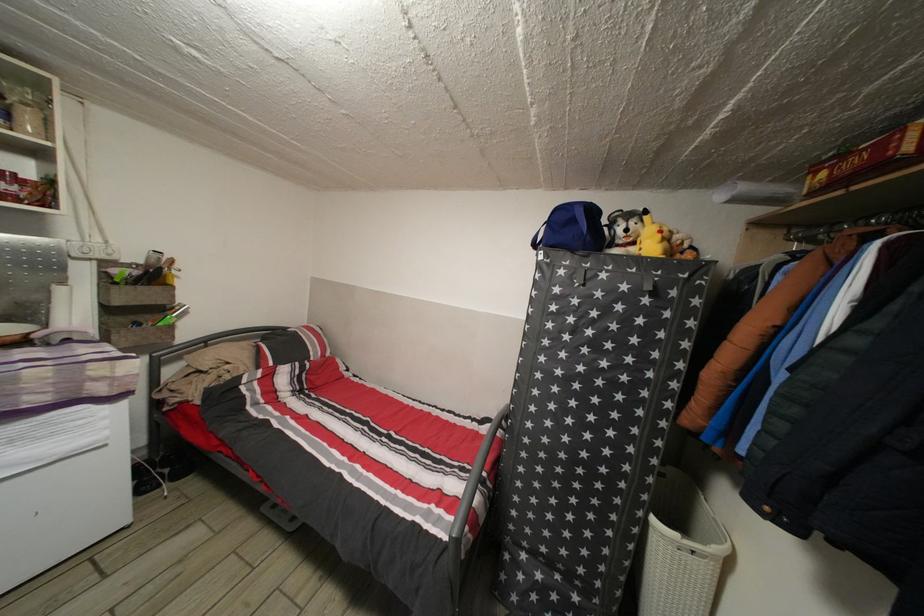
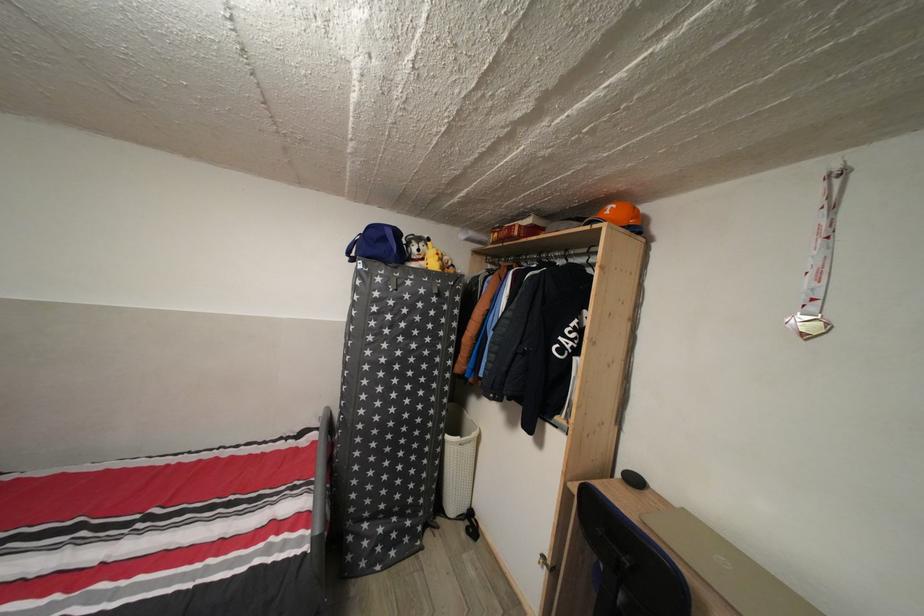
In the second image, find the point that corresponds to point (665, 243) in the first image.

(444, 264)